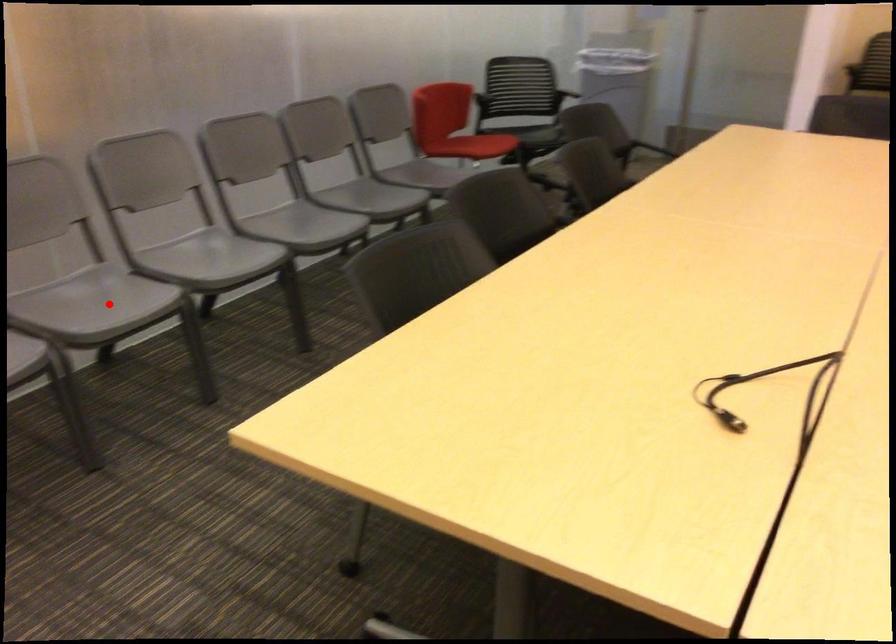
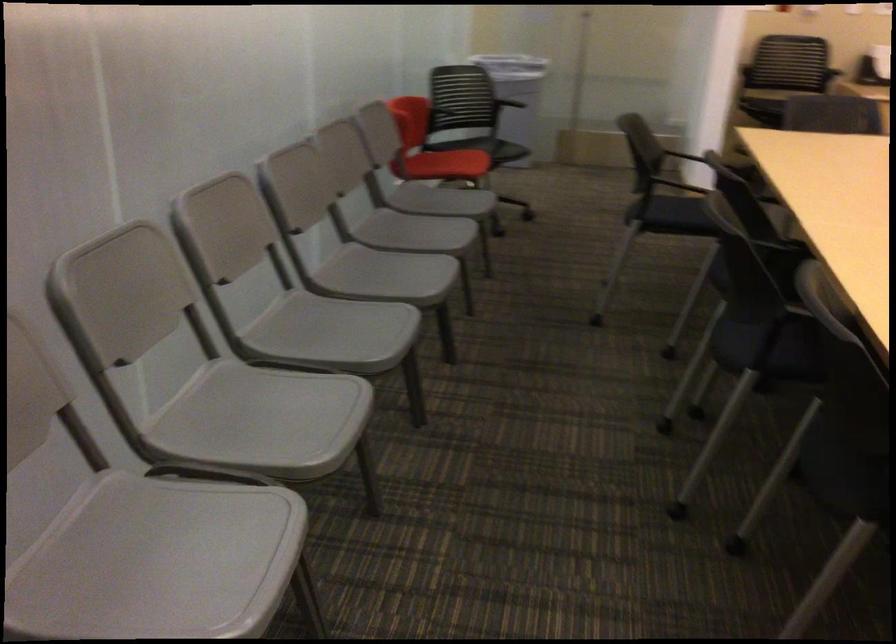
Where in the second image is the point corresponding to the highlighted location from the first image?

(263, 420)